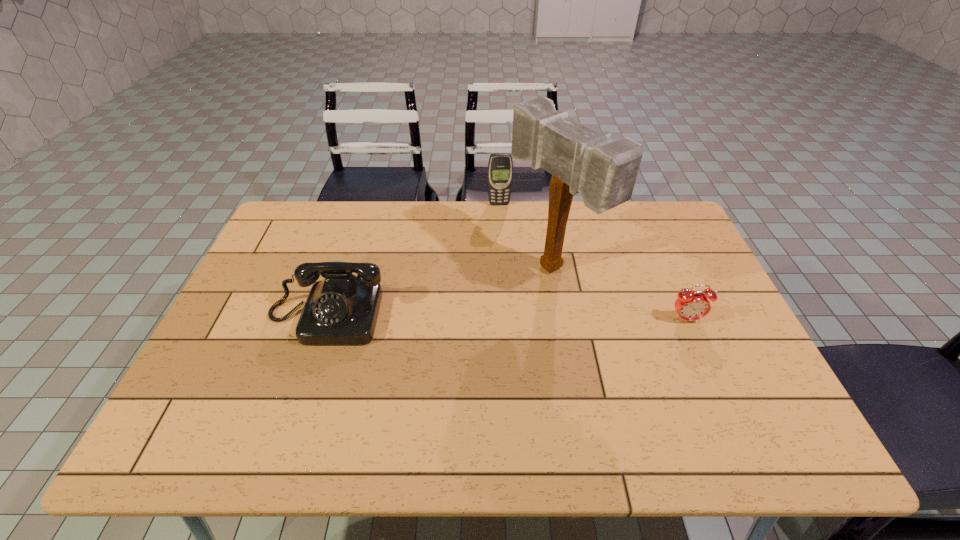
Where is `free space between the second tallest object and the tallest object`? free space between the second tallest object and the tallest object is located at coordinates (525, 237).

Where is `unoccupied position between the telephone and the shortest object`? The height and width of the screenshot is (540, 960). unoccupied position between the telephone and the shortest object is located at coordinates (506, 318).

The width and height of the screenshot is (960, 540). In order to click on free space between the cellular telephone and the tallest object in this screenshot , I will do `click(525, 237)`.

Image resolution: width=960 pixels, height=540 pixels. What are the coordinates of `vacant space that's between the mallet and the telephone` in the screenshot? It's located at (439, 293).

What are the coordinates of `object that is the nearest to the rightmost object` in the screenshot? It's located at (604, 171).

Where is `object that can be found as the third closest to the mallet`? The width and height of the screenshot is (960, 540). object that can be found as the third closest to the mallet is located at coordinates (342, 309).